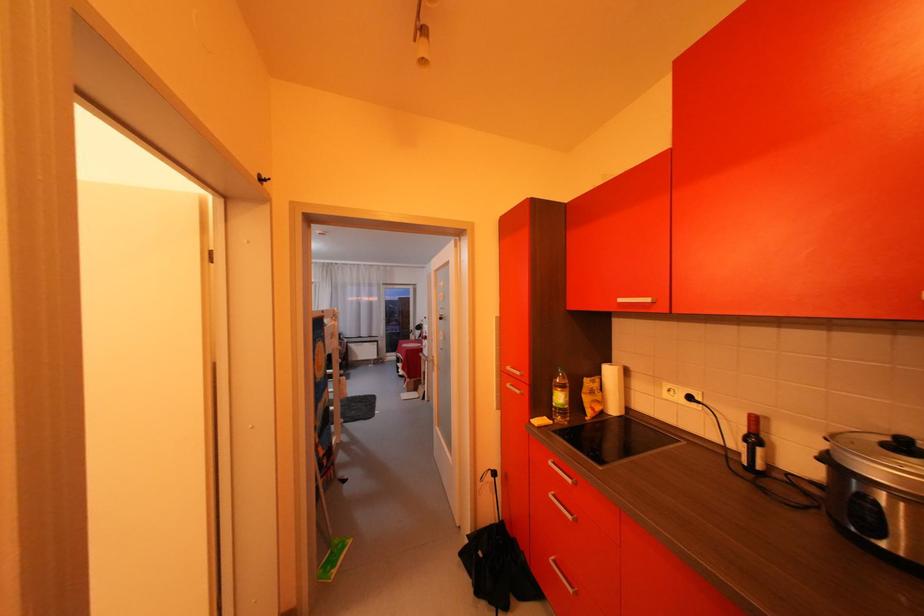
This screenshot has width=924, height=616. I want to click on cooker lid handle, so click(x=902, y=446).